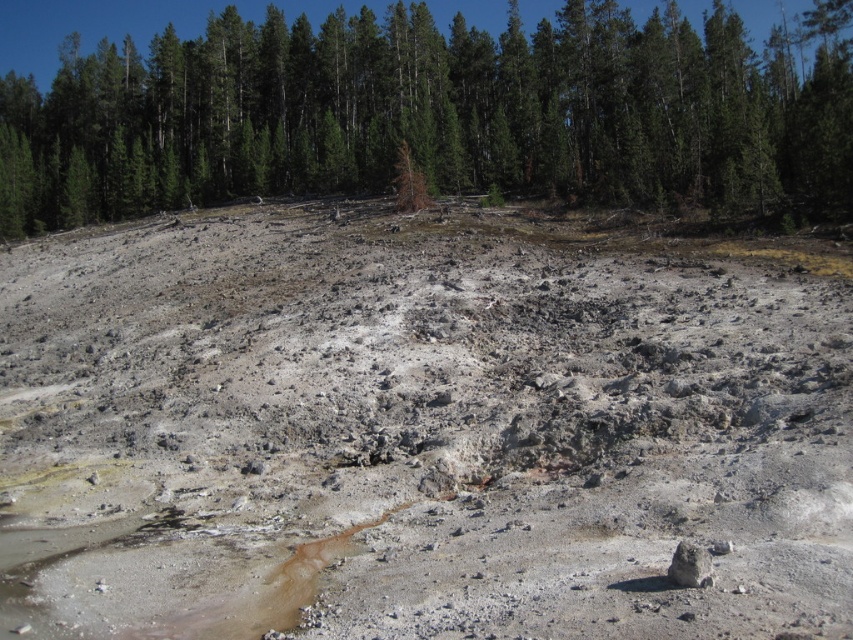
Between gray rocky hillside at center and green matte tree at upper center, which one has less height?

gray rocky hillside at center

Who is more distant from viewer, (317, 269) or (502, 157)?

Positioned behind is point (502, 157).

The height and width of the screenshot is (640, 853). Identify the location of gray rocky hillside at center. (415, 433).